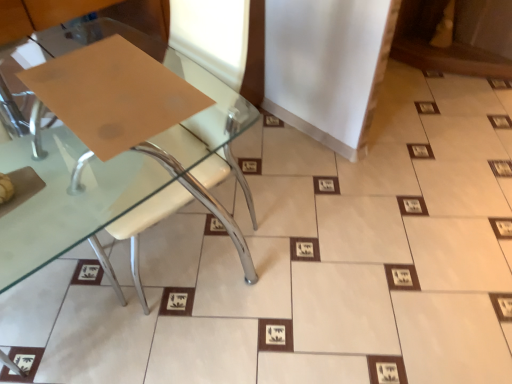
Locate an element on the screen. Image resolution: width=512 pixels, height=384 pixels. free space above matte brown paper at upper left (from a real-world perspective) is located at coordinates tap(111, 85).